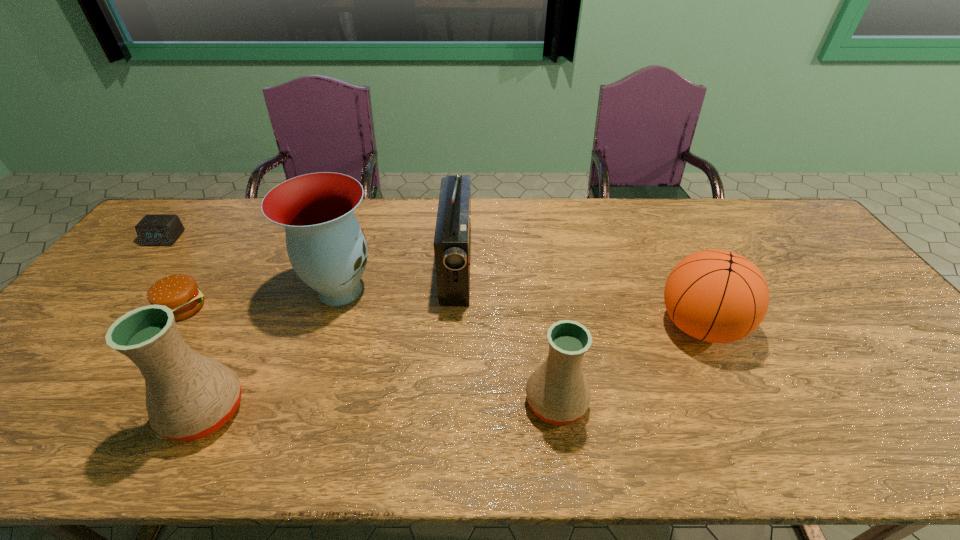
This screenshot has width=960, height=540. I want to click on the fourth object from right to left, so click(326, 246).

Identify the location of vacant space located on the back of the fifth object from right to left. pyautogui.click(x=276, y=270).

You are a GUI agent. You are given a task and a screenshot of the screen. Output one action in this format:
    pyautogui.click(x=<x>, y=<y>)
    Task: Click on the vacant space situated on the right of the right pottery
    The width and height of the screenshot is (960, 540).
    Given the screenshot: What is the action you would take?
    coord(636,402)

Identify the location of free space located 0.370m on the front-facing side of the leftmost object. (81, 338).

Where is `vacant space situated on the back of the second object from left to right`? This screenshot has height=540, width=960. vacant space situated on the back of the second object from left to right is located at coordinates (232, 234).

You are a GUI agent. You are given a task and a screenshot of the screen. Output one action in this format:
    pyautogui.click(x=<x>, y=<y>)
    Task: Click on the free space located on the front-facing side of the radio receiver
    This screenshot has width=960, height=540.
    Given the screenshot: What is the action you would take?
    pyautogui.click(x=552, y=268)

Where is `free space located on the back of the rightmost object`? free space located on the back of the rightmost object is located at coordinates (648, 218).

The width and height of the screenshot is (960, 540). I want to click on free space located on the back of the vase, so click(368, 207).

Find the location of a particular element. The height and width of the screenshot is (540, 960). alarm clock that is at the far edge is located at coordinates (153, 230).

Identify the location of radio receiver that is at the far edge. (452, 242).